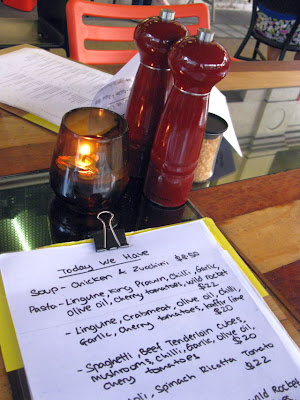
You are a GUI agent. You are given a task and a screenshot of the screen. Output one action in this format:
    pyautogui.click(x=<x>, y=<y>)
    Task: Click on the brown glass container with lit candle inside
    The height and width of the screenshot is (400, 300).
    Given the screenshot: What is the action you would take?
    [x=105, y=161]